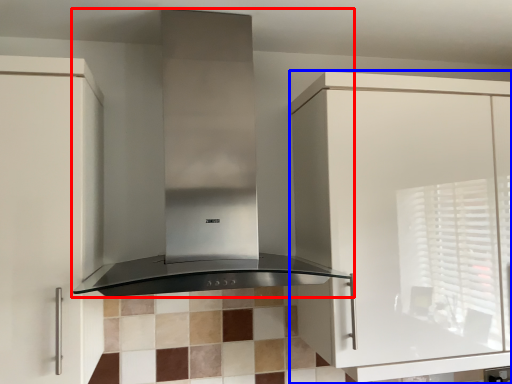
Question: Which point is closer to the camera, home appliance (highlighted by a red box) or cabinetry (highlighted by a blue box)?

Choices:
 (A) home appliance
 (B) cabinetry

Answer: (A)